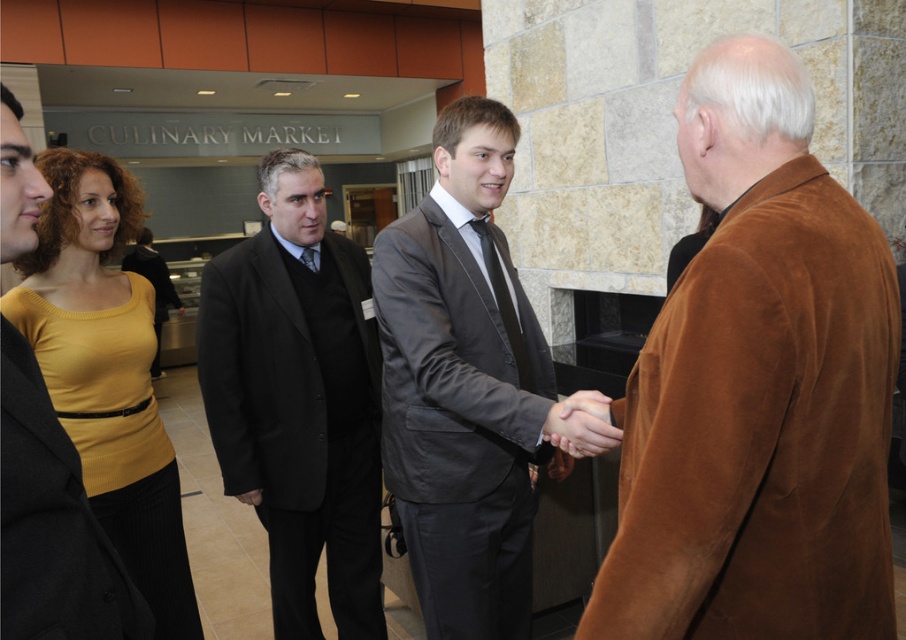
You are standing at the center of the room. Which object is located at the point with coordinates (463, 385)?

The gray suit at center is located at the point with coordinates (463, 385).

You are attending a professional event and need to locate the person wearing a yellow knit top at upper left. Based on the scene description, where would you find them in relation to the smooth leather hand at center?

The yellow knit top at upper left is to the left of the smooth leather hand at center.

Based on the photo, you are standing at the point marked as point (137, 449) in the image. You need to walk to the exit located at the opposite side of the room. Considering the distance between you and the exit is 10 feet, will you be able to reach the exit without moving past the two men shaking hands?

The distance between you and the viewer is 6.47 feet, but the total distance to the exit is 10 feet. Since 6.47 feet is less than 10 feet, you can reach the exit without moving past the two men shaking hands.